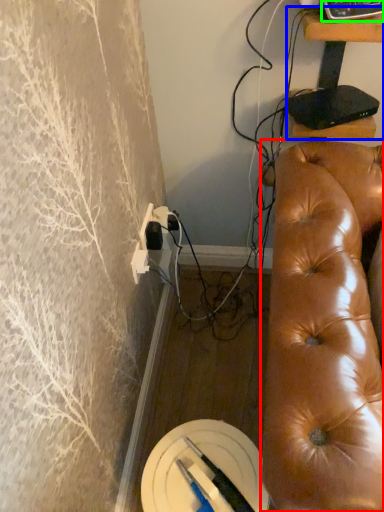
Question: Based on their relative distances, which object is farther from studio couch (highlighted by a red box)? Choose from furniture (highlighted by a blue box) and equipment (highlighted by a green box).

Choices:
 (A) furniture
 (B) equipment

Answer: (B)